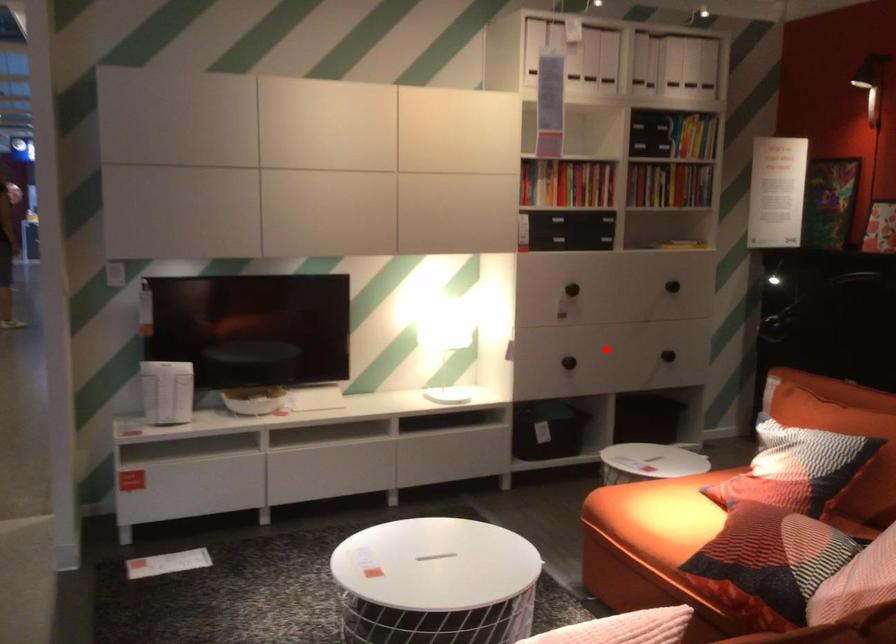
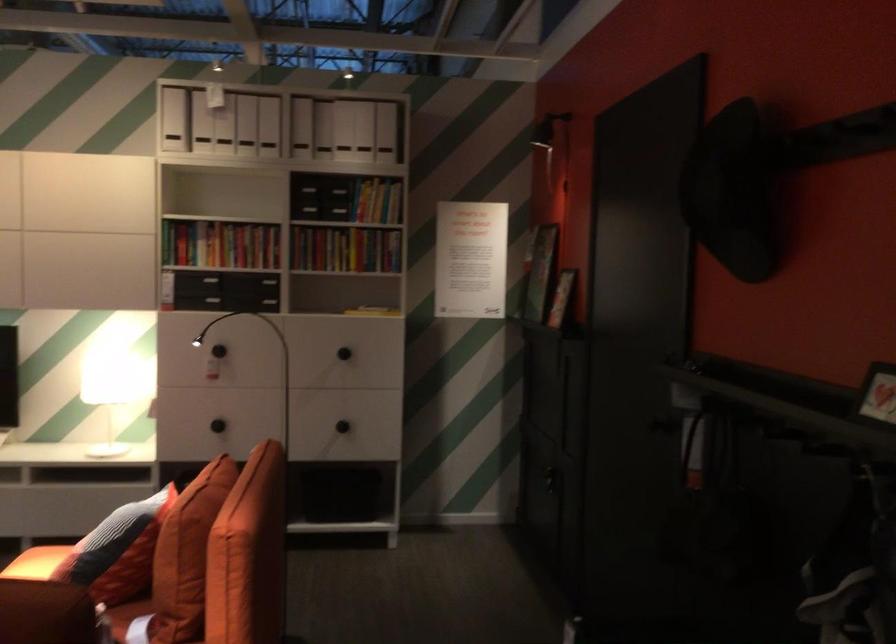
The point at the highlighted location is marked in the first image. Where is the corresponding point in the second image?

(218, 426)